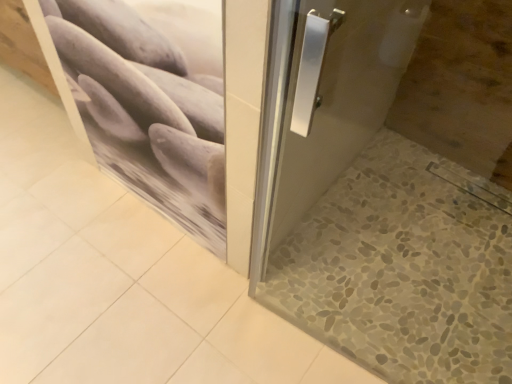
Question: Is gray pebble tile at lower right situated inside matte stone pebble at upper left or outside?

Choices:
 (A) outside
 (B) inside

Answer: (A)

Question: From a real-world perspective, is gray pebble tile at lower right physically located above or below matte stone pebble at upper left?

Choices:
 (A) above
 (B) below

Answer: (B)

Question: From the image's perspective, is gray pebble tile at lower right above or below matte stone pebble at upper left?

Choices:
 (A) below
 (B) above

Answer: (A)

Question: Is matte stone pebble at upper left situated inside gray pebble tile at lower right or outside?

Choices:
 (A) outside
 (B) inside

Answer: (A)

Question: Considering the positions of point (86, 51) and point (382, 256), is point (86, 51) closer or farther from the camera than point (382, 256)?

Choices:
 (A) farther
 (B) closer

Answer: (B)

Question: From the image's perspective, is matte stone pebble at upper left positioned above or below gray pebble tile at lower right?

Choices:
 (A) below
 (B) above

Answer: (B)

Question: In terms of height, does matte stone pebble at upper left look taller or shorter compared to gray pebble tile at lower right?

Choices:
 (A) tall
 (B) short

Answer: (A)